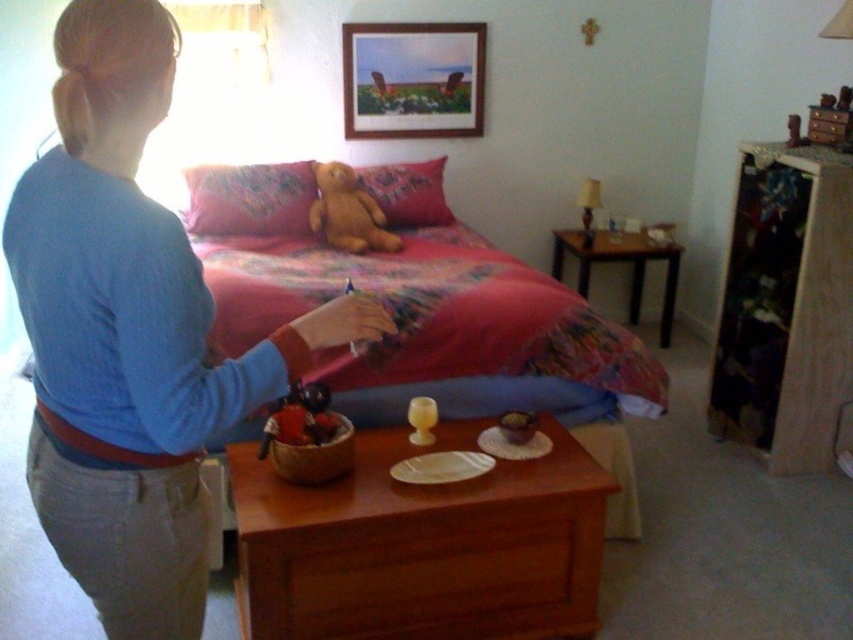
Question: Can you confirm if blue cotton shirt at upper left is positioned to the left of fluffy fabric bed at center?

Choices:
 (A) yes
 (B) no

Answer: (A)

Question: In this image, where is blue cotton shirt at upper left located relative to fluffy fabric bed at center?

Choices:
 (A) right
 (B) left

Answer: (B)

Question: Can you confirm if blue cotton shirt at upper left is wider than fluffy fabric bed at center?

Choices:
 (A) no
 (B) yes

Answer: (A)

Question: Which point is closer to the camera taking this photo?

Choices:
 (A) (103, 461)
 (B) (263, 262)

Answer: (A)